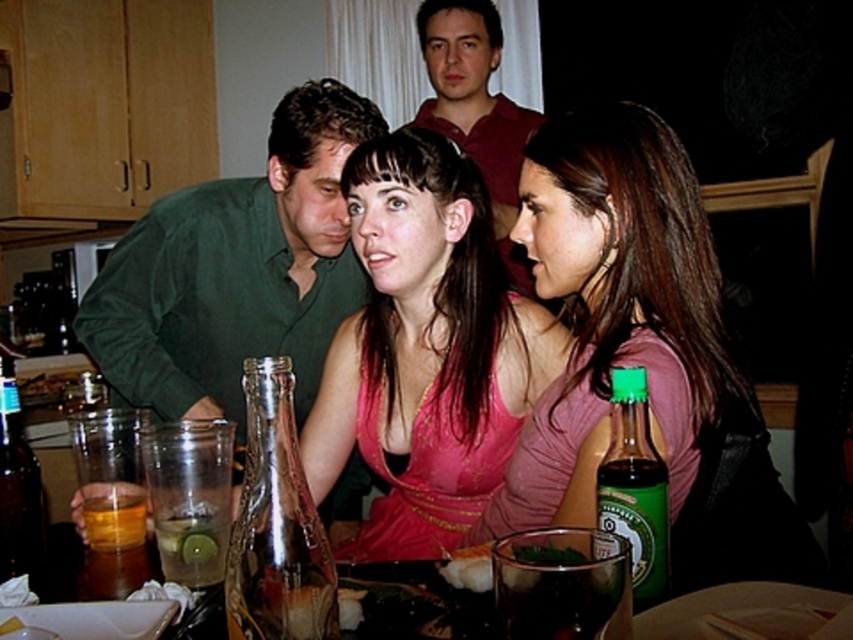
Is clear glass bottle at center closer to the viewer compared to amber liquid glass at lower left?

Yes, clear glass bottle at center is closer to the viewer.

Between clear glass bottle at center and amber liquid glass at lower left, which one has less height?

With less height is amber liquid glass at lower left.

Which is in front, point (264, 451) or point (85, 506)?

Point (264, 451) is in front.

At what (x,y) coordinates should I click in order to perform the action: click on clear glass bottle at center. Please return your answer as a coordinate pair (x, y). Image resolution: width=853 pixels, height=640 pixels. Looking at the image, I should click on (276, 524).

Does translucent glass bottle at lower left appear under amber liquid glass at lower left?

Actually, translucent glass bottle at lower left is above amber liquid glass at lower left.

Between translucent glass bottle at lower left and amber liquid glass at lower left, which one is positioned higher?

translucent glass bottle at lower left is higher up.

Is point (13, 428) positioned behind point (106, 499)?

No.

I want to click on translucent glass bottle at lower left, so click(x=18, y=490).

How much distance is there between pink fabric dress at center and green matte shirt at left?

pink fabric dress at center and green matte shirt at left are 25.15 inches apart from each other.

This screenshot has width=853, height=640. Find the location of `pink fabric dress at center`. pink fabric dress at center is located at coordinates (642, 353).

This screenshot has width=853, height=640. I want to click on pink fabric dress at center, so click(642, 353).